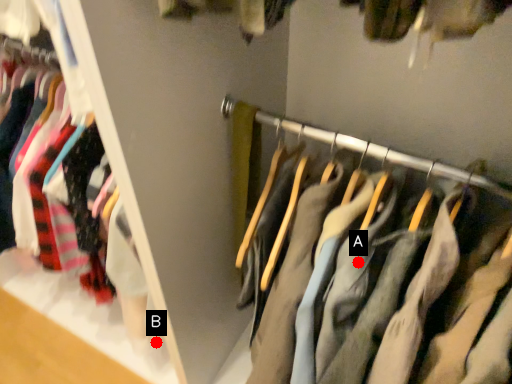
Question: Two points are circled on the image, labeled by A and B beside each circle. Which point is closer to the camera?

Choices:
 (A) A is closer
 (B) B is closer

Answer: (A)